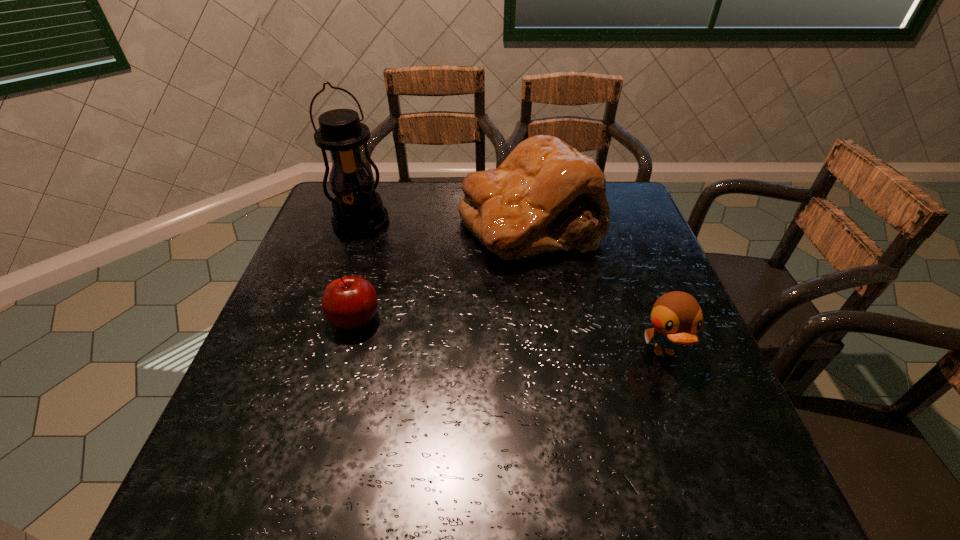
Locate an element on the screen. This screenshot has width=960, height=540. free point located on the filling side of the bread is located at coordinates (497, 332).

At what (x,y) coordinates should I click in order to perform the action: click on vacant area located 0.390m on the filling side of the bread. Please return your answer as a coordinate pair (x, y). Looking at the image, I should click on (475, 403).

Image resolution: width=960 pixels, height=540 pixels. What are the coordinates of `lantern that is at the far edge` in the screenshot? It's located at (358, 211).

Find the location of a particular element. The height and width of the screenshot is (540, 960). bread that is at the far edge is located at coordinates (546, 196).

Locate an element on the screen. apple that is positioned at the left edge is located at coordinates (350, 302).

Find the location of a particular element. This screenshot has height=540, width=960. lantern that is at the left edge is located at coordinates (358, 211).

This screenshot has height=540, width=960. I want to click on duck that is at the right edge, so click(676, 316).

The image size is (960, 540). Identify the location of bread present at the right edge. (546, 196).

This screenshot has height=540, width=960. I want to click on object that is at the far left corner, so click(358, 211).

The height and width of the screenshot is (540, 960). Identify the location of object that is at the far right corner. (546, 196).